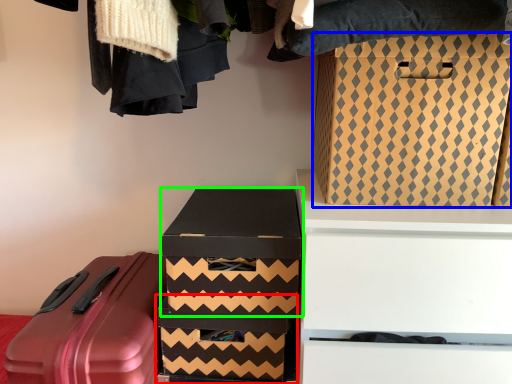
Question: Based on their relative distances, which object is nearer to box (highlighted by a red box)? Choose from box (highlighted by a blue box) and box (highlighted by a green box).

Choices:
 (A) box
 (B) box

Answer: (B)